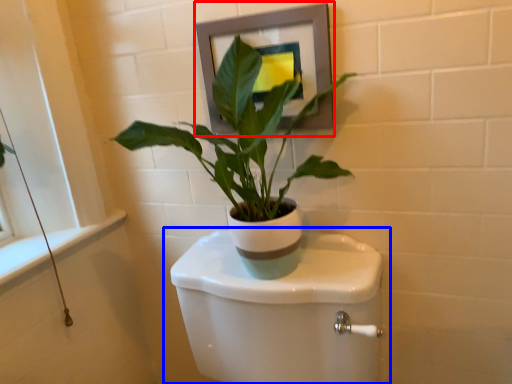
Question: Which point is further to the camera, picture frame (highlighted by a red box) or toilet (highlighted by a blue box)?

Choices:
 (A) picture frame
 (B) toilet

Answer: (A)